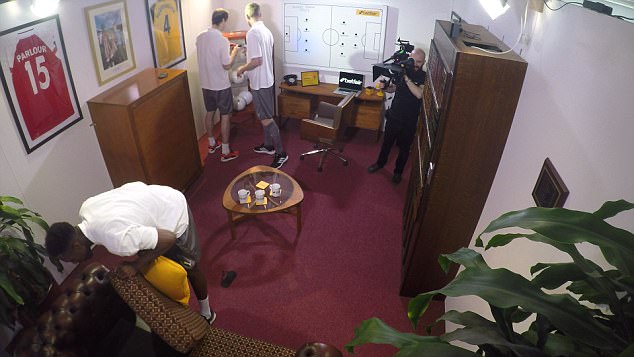
This screenshot has width=634, height=357. I want to click on rolling chair, so click(x=331, y=126).